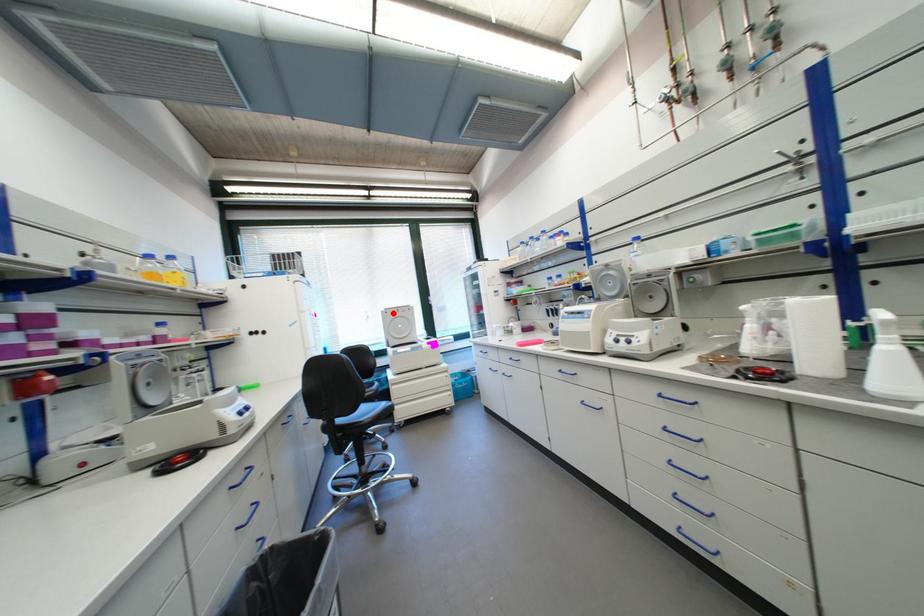
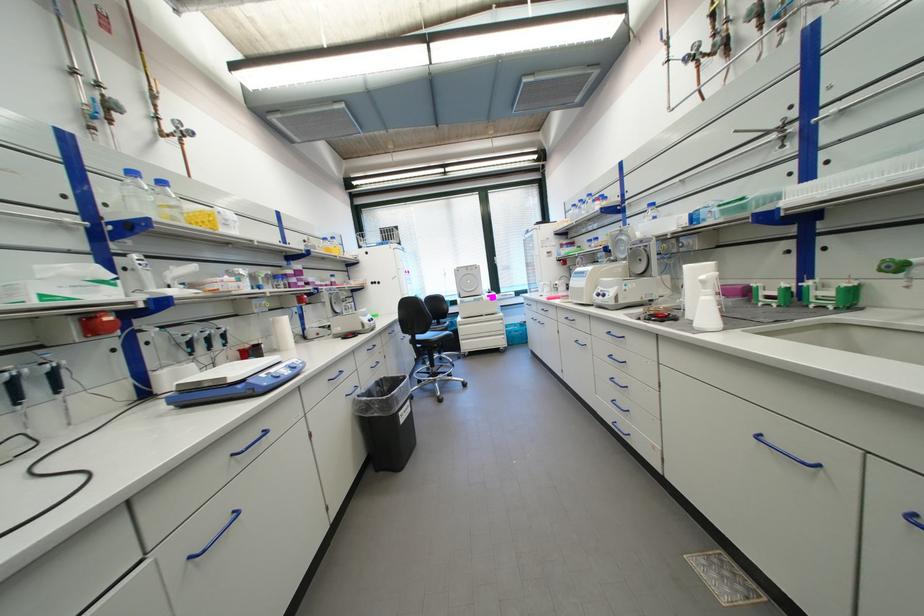
Find the pixel in the second image that matches the highlighted location in the first image.

(466, 272)